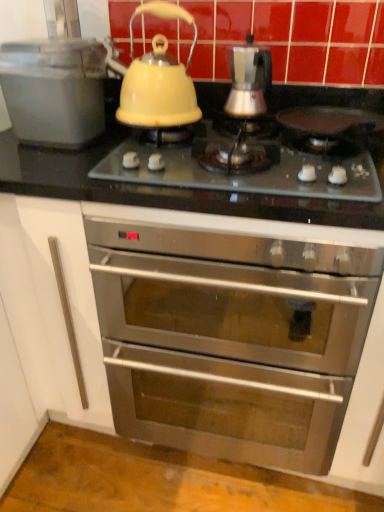
Question: Can you confirm if stainless steel oven at center is thinner than matte glass cooktop at center?

Choices:
 (A) yes
 (B) no

Answer: (B)

Question: Could you tell me if stainless steel oven at center is turned towards matte glass cooktop at center?

Choices:
 (A) no
 (B) yes

Answer: (A)

Question: Does stainless steel oven at center appear on the left side of matte glass cooktop at center?

Choices:
 (A) no
 (B) yes

Answer: (B)

Question: From the image's perspective, is stainless steel oven at center under matte glass cooktop at center?

Choices:
 (A) no
 (B) yes

Answer: (B)

Question: Is stainless steel oven at center far from matte glass cooktop at center?

Choices:
 (A) no
 (B) yes

Answer: (A)

Question: From a real-world perspective, is stainless steel oven at center positioned under matte glass cooktop at center based on gravity?

Choices:
 (A) yes
 (B) no

Answer: (A)

Question: From the image's perspective, is stainless steel oven at center over yellow glossy kettle at upper center?

Choices:
 (A) yes
 (B) no

Answer: (B)

Question: Can you confirm if stainless steel oven at center is shorter than yellow glossy kettle at upper center?

Choices:
 (A) no
 (B) yes

Answer: (A)

Question: Considering the relative sizes of stainless steel oven at center and yellow glossy kettle at upper center in the image provided, is stainless steel oven at center taller than yellow glossy kettle at upper center?

Choices:
 (A) no
 (B) yes

Answer: (B)

Question: From a real-world perspective, is stainless steel oven at center under yellow glossy kettle at upper center?

Choices:
 (A) yes
 (B) no

Answer: (A)

Question: Is stainless steel oven at center far away from yellow glossy kettle at upper center?

Choices:
 (A) yes
 (B) no

Answer: (B)

Question: Is stainless steel oven at center closer to camera compared to yellow glossy kettle at upper center?

Choices:
 (A) no
 (B) yes

Answer: (B)

Question: Is matte plastic container at left, placed as the 1th kitchen appliance when sorted from left to right, to the left of satin silver coffee maker at center, positioned as the 2th kitchen appliance in left-to-right order, from the viewer's perspective?

Choices:
 (A) yes
 (B) no

Answer: (A)